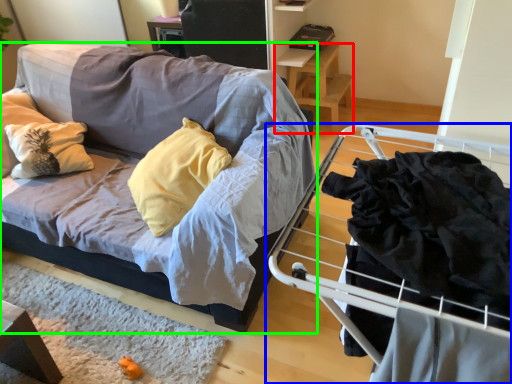
Question: Which object is positioned farthest from table (highlighted by a red box)? Select from furniture (highlighted by a blue box) and studio couch (highlighted by a green box).

Choices:
 (A) furniture
 (B) studio couch

Answer: (A)